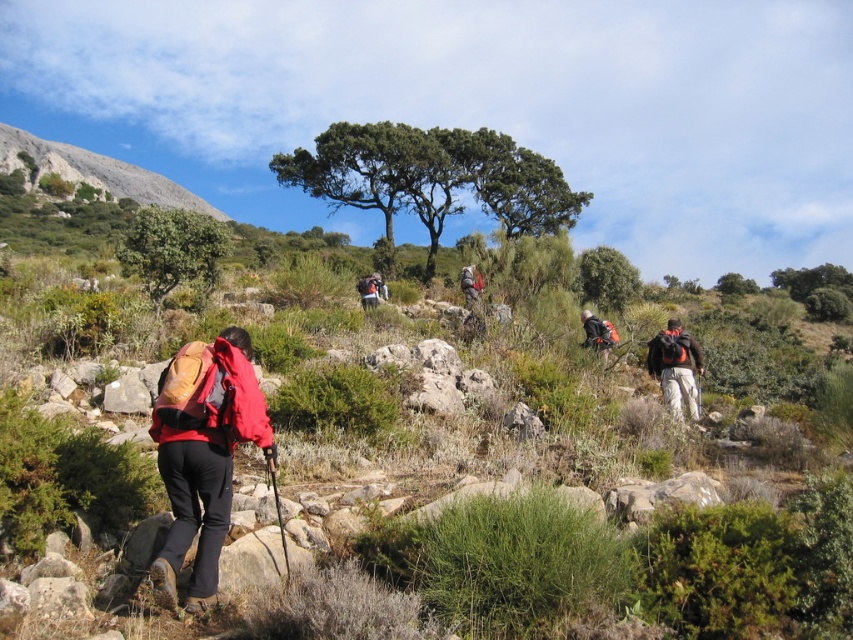
Who is positioned more to the left, matte black backpack at right or matte gray backpack at center?

Positioned to the left is matte gray backpack at center.

Measure the distance between point (665, 372) and camera.

Point (665, 372) is 16.09 meters away from camera.

You are a GUI agent. You are given a task and a screenshot of the screen. Output one action in this format:
    pyautogui.click(x=<x>, y=<y>)
    Task: Click on the matte black backpack at right
    Image resolution: width=853 pixels, height=640 pixels.
    Given the screenshot: What is the action you would take?
    (x=676, y=369)

Image resolution: width=853 pixels, height=640 pixels. Describe the element at coordinates (202, 451) in the screenshot. I see `matte red jacket at lower left` at that location.

Does point (171, 394) come in front of point (364, 296)?

That is True.

What do you see at coordinates (202, 451) in the screenshot? I see `matte red jacket at lower left` at bounding box center [202, 451].

Locate an element on the screen. matte red jacket at lower left is located at coordinates (202, 451).

This screenshot has width=853, height=640. I want to click on matte red jacket at lower left, so click(x=202, y=451).

Which is in front, point (270, 442) or point (679, 358)?

Point (270, 442)

Is point (170, 420) less distant than point (648, 362)?

That is True.

Find the location of a particular element. Image resolution: width=853 pixels, height=640 pixels. matte red jacket at lower left is located at coordinates (202, 451).